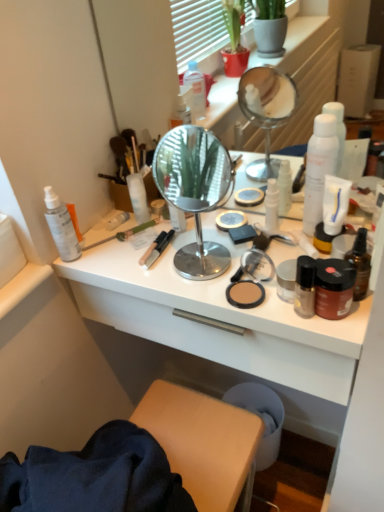
The width and height of the screenshot is (384, 512). What are the coordinates of `vacant area that lies between polished chrome mirror at center and clear plastic tube at center, the third toiletry in the left-to-right sequence` in the screenshot? It's located at (158, 243).